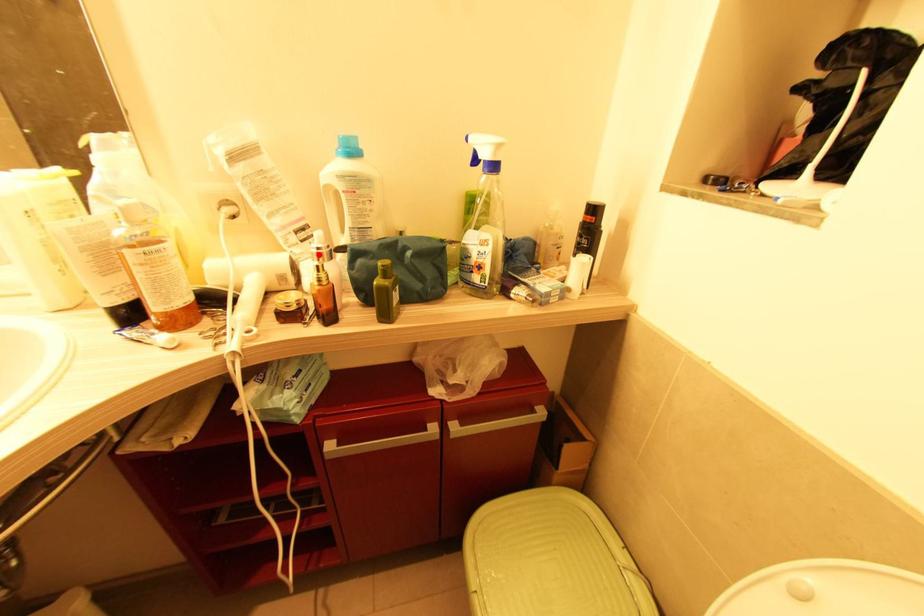
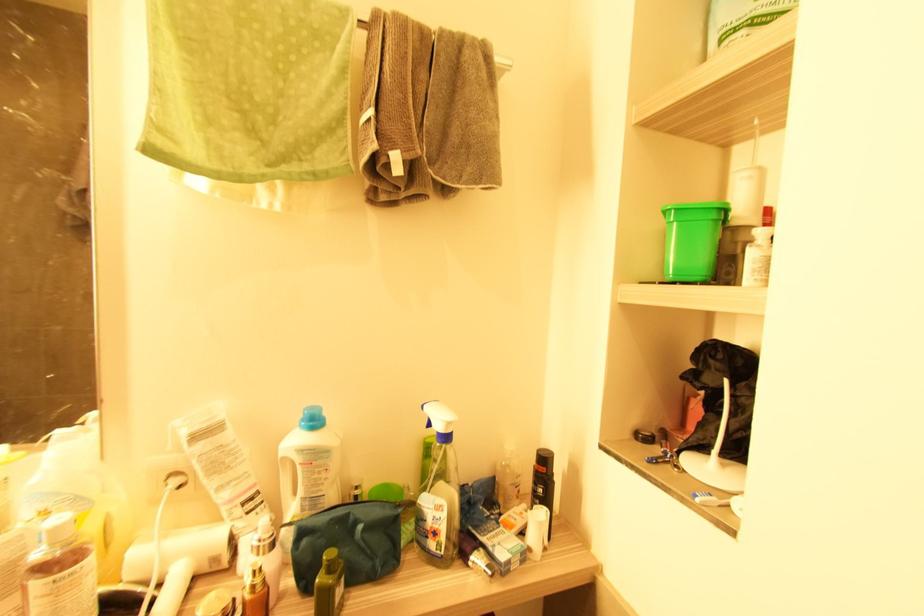
Where in the second image is the point corresponding to the highlighted location from the first image?

(261, 546)